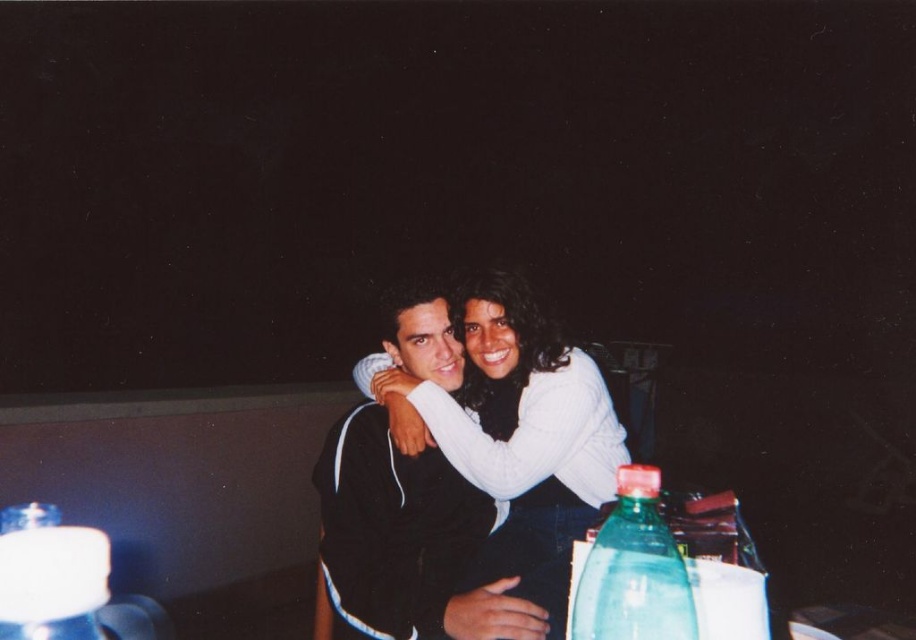
You are a photographer setting up for a night shoot. You notice the black matte jacket at center and the translucent plastic bottle at lower left in your frame. Which object is closer to the camera?

The black matte jacket at center is closer to the camera because the translucent plastic bottle at lower left is positioned behind it.

You are a photographer setting up a tripod in this scene. You need to place it between the black matte jacket at center and the translucent plastic bottle at lower right. Is the space between them sufficient to fit the tripod?

The black matte jacket at center is below the translucent plastic bottle at lower right, so the vertical space between them may be sufficient for the tripod, but the horizontal positioning needs to be considered based on their actual placement.

You are a photographer setting up equipment for a night shoot. You need to place a 30 inch tripod between the black matte jacket at center and the translucent plastic bottle at lower right. Can you fit it there without moving either object?

The distance between the black matte jacket at center and the translucent plastic bottle at lower right is 29.26 inches. Since the tripod requires 30 inches of space, it will not fit without moving one of the objects.